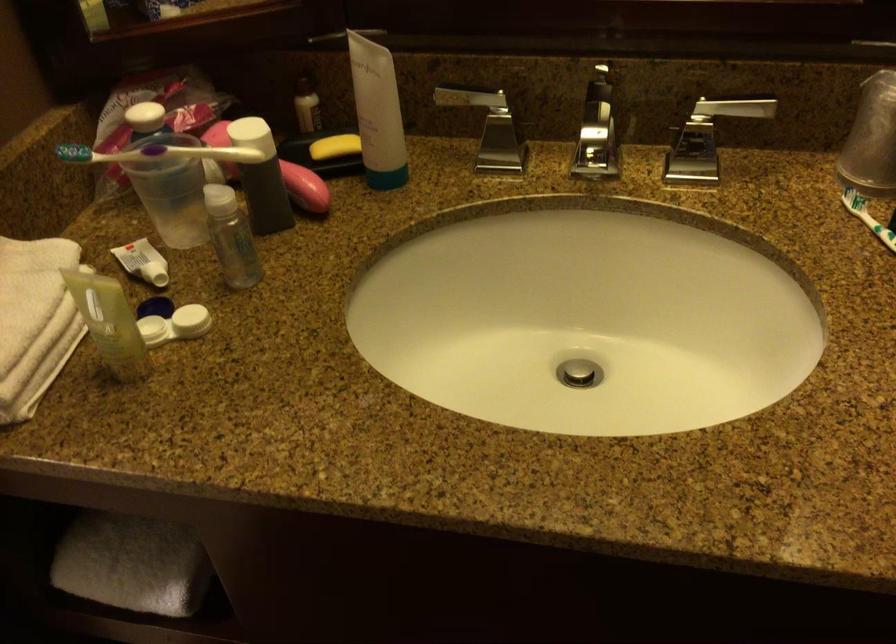
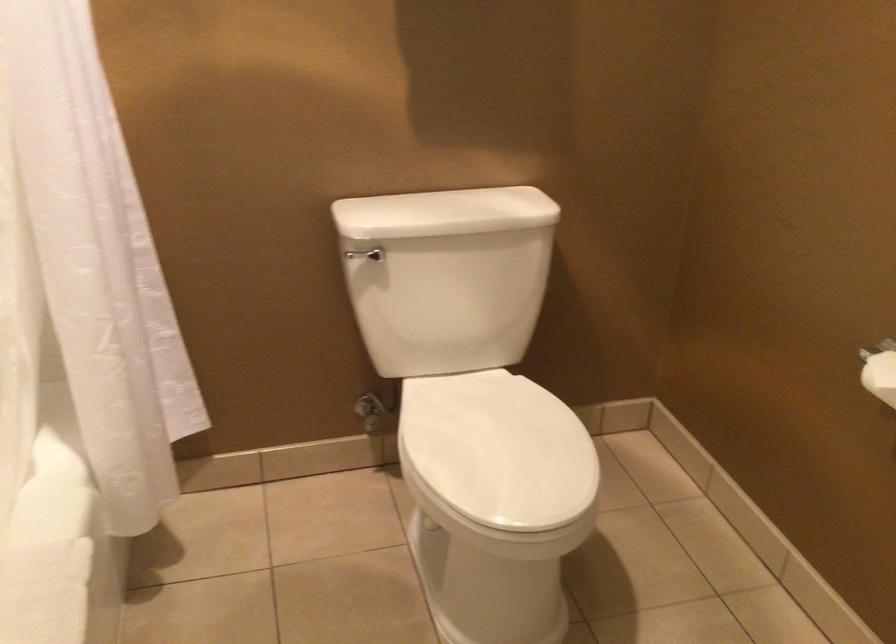
Question: The first image is from the beginning of the video and the second image is from the end. How did the camera likely rotate when shooting the video?

Choices:
 (A) Left
 (B) Right
 (C) Up
 (D) Down

Answer: (A)